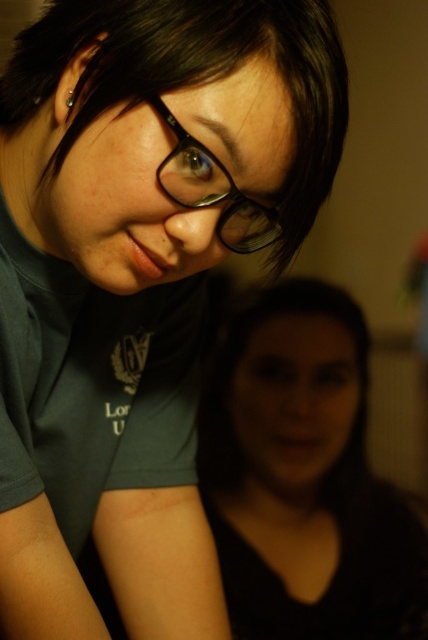
You are trying to determine the spatial relationship between the black matte hair at lower center and the black matte glasses at upper center. Based on the scene, which object is located to the right of the other?

The black matte hair at lower center is positioned on the right side of black matte glasses at upper center.

You are a photographer adjusting your camera settings to focus on the black matte hair at lower center and the black matte glasses at upper center. Which object should you adjust your focus to first if you want to ensure both are in focus without moving the camera?

The black matte glasses at upper center should be focused on first because it is closer to the camera than the black matte hair at lower center, which is taller and farther away.